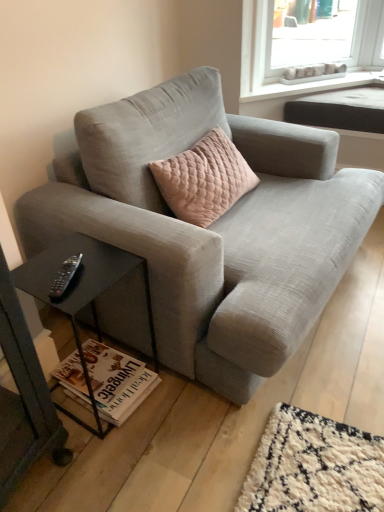
This screenshot has width=384, height=512. Find the location of `vacant area that is in front of black glass table at lower left`. vacant area that is in front of black glass table at lower left is located at coordinates (99, 463).